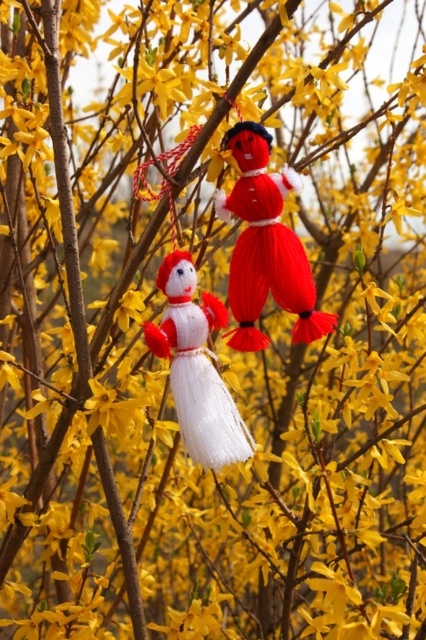
Where is `knitted woolen doll at center`? The image size is (426, 640). knitted woolen doll at center is located at coordinates (265, 244).

Which is below, knitted woolen doll at center or white yarn snowman at center?

white yarn snowman at center is below.

Is point (268, 145) less distant than point (181, 264)?

That is True.

Identify the location of knitted woolen doll at center. (265, 244).